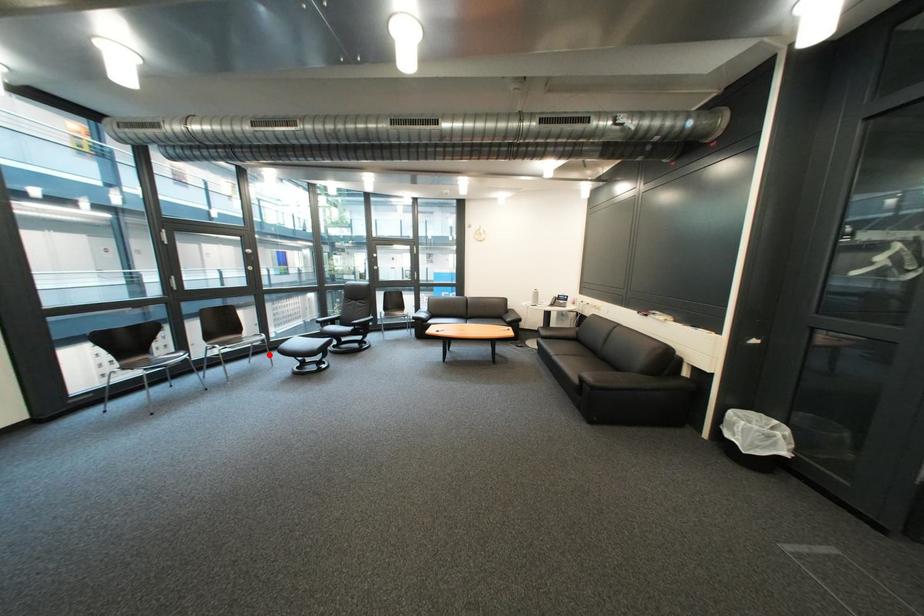
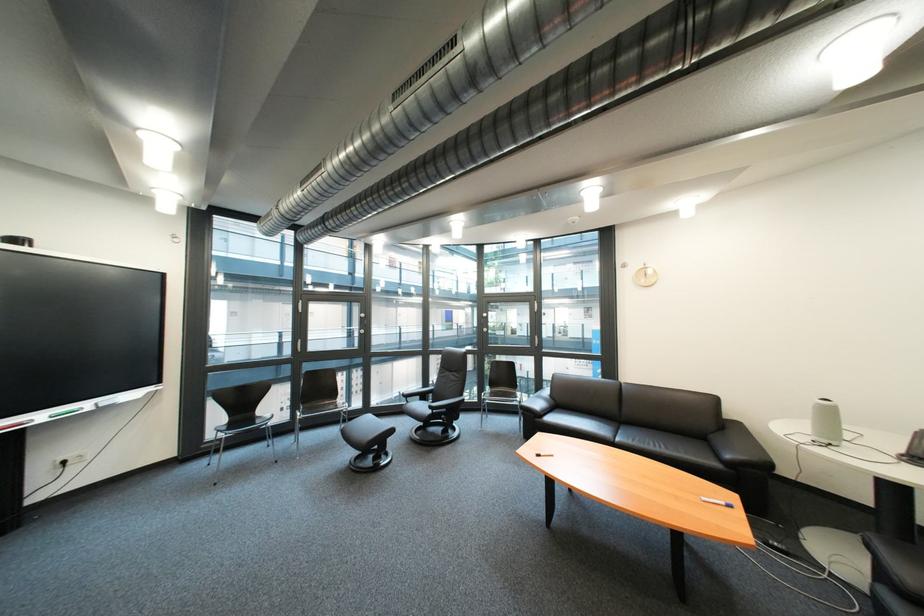
Question: I am providing you with two images of the same scene from different viewpoints. A red point is marked on the first image. Is the red point's position out of view in image 2?

Choices:
 (A) Yes
 (B) No

Answer: (B)